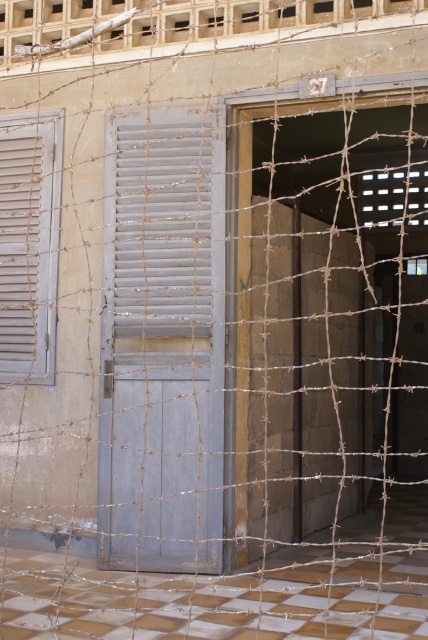
Question: Which object appears farthest from the camera in this image?

Choices:
 (A) light gray wooden shutter at left
 (B) gray matte door at center

Answer: (A)

Question: Does gray matte door at center appear under light gray wooden shutter at left?

Choices:
 (A) yes
 (B) no

Answer: (A)

Question: Which point is closer to the camera taking this photo?

Choices:
 (A) click(17, 275)
 (B) click(142, 129)
 (C) click(208, 388)

Answer: (C)

Question: Among these objects, which one is farthest from the camera?

Choices:
 (A) gray matte door at center
 (B) light gray wooden shutter at left

Answer: (B)

Question: Does gray matte door at center have a lesser width compared to light gray wooden shutter at left?

Choices:
 (A) yes
 (B) no

Answer: (B)

Question: Does gray matte door at center have a larger size compared to white matte shutter at center?

Choices:
 (A) no
 (B) yes

Answer: (B)